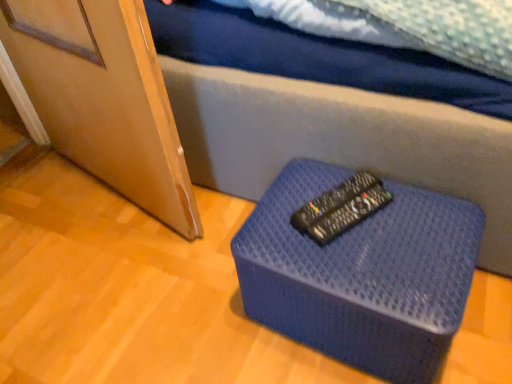
Where is `vacant space that is to the left of black plastic remote at center`? The height and width of the screenshot is (384, 512). vacant space that is to the left of black plastic remote at center is located at coordinates (279, 216).